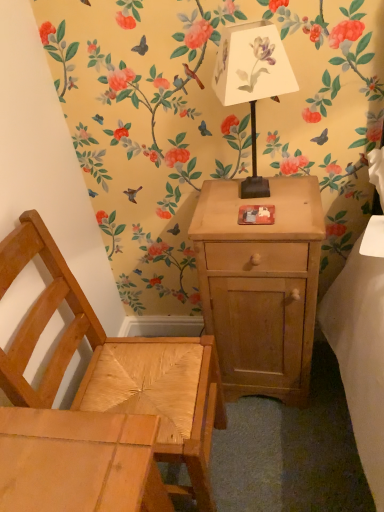
Find the location of a particular element. vacant space in white paper lampshade at upper center (from a real-world perspective) is located at coordinates (250, 195).